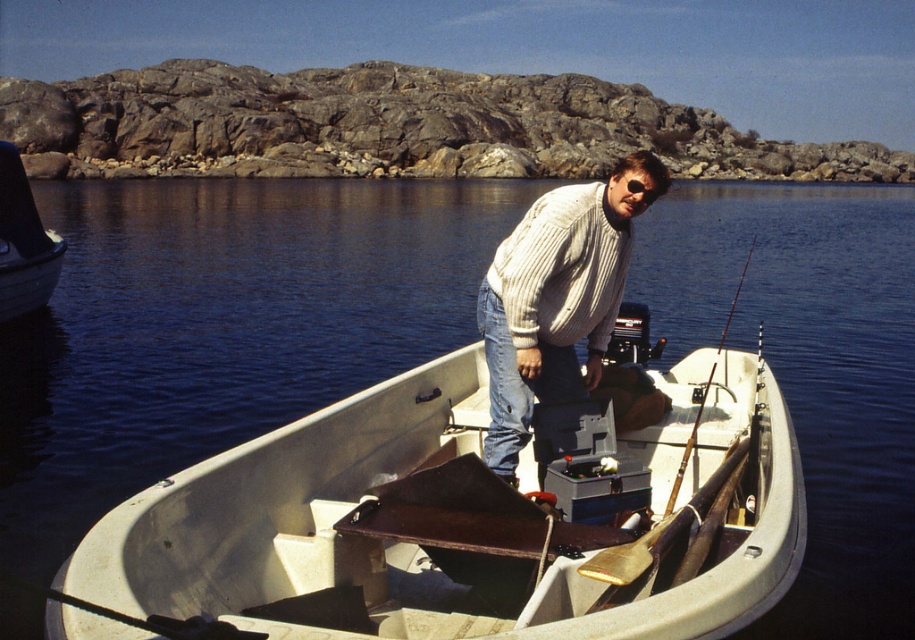
Question: Which point is farther to the camera?

Choices:
 (A) metallic gray boat at left
 (B) white plastic boat at center

Answer: (A)

Question: Can you confirm if white plastic boat at center is bigger than white knitted sweater at center?

Choices:
 (A) yes
 (B) no

Answer: (B)

Question: Estimate the real-world distances between objects in this image. Which object is closer to the metallic gray boat at left?

Choices:
 (A) white knitted sweater at center
 (B) white plastic boat at center

Answer: (A)

Question: In this image, where is white plastic boat at center located relative to white knitted sweater at center?

Choices:
 (A) below
 (B) above

Answer: (A)

Question: Estimate the real-world distances between objects in this image. Which object is closer to the metallic gray boat at left?

Choices:
 (A) white plastic boat at center
 (B) white knitted sweater at center

Answer: (B)

Question: Is white knitted sweater at center thinner than metallic gray boat at left?

Choices:
 (A) yes
 (B) no

Answer: (A)